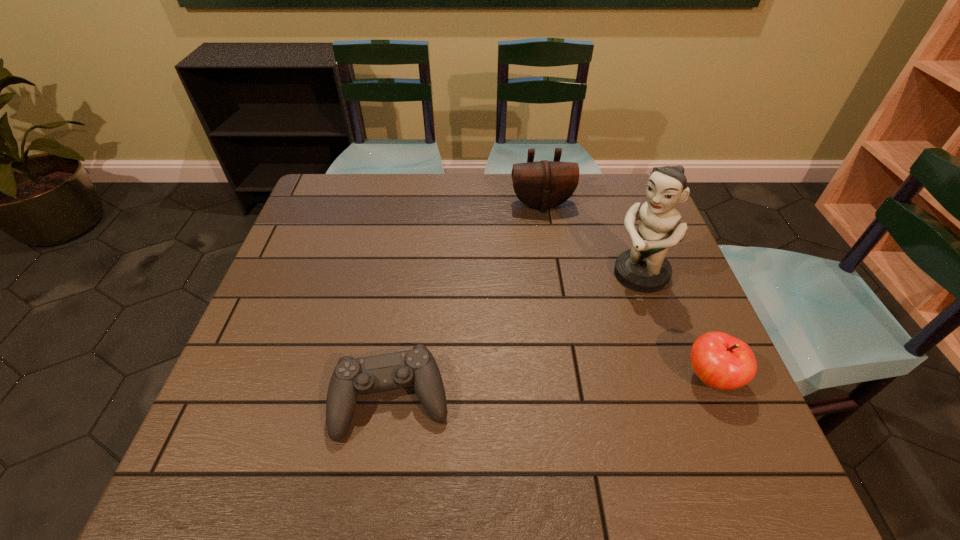
Locate an element on the screen. Image resolution: width=960 pixels, height=540 pixels. vacant space located with the flap open on the pouch is located at coordinates (561, 285).

Where is `vacant space located with the flap open on the pouch`? This screenshot has height=540, width=960. vacant space located with the flap open on the pouch is located at coordinates (558, 273).

Where is `free location located 0.230m on the front-facing side of the third nearest object`? The width and height of the screenshot is (960, 540). free location located 0.230m on the front-facing side of the third nearest object is located at coordinates (564, 340).

This screenshot has width=960, height=540. What are the coordinates of `vacant space located on the front-facing side of the third nearest object` in the screenshot? It's located at pyautogui.click(x=581, y=325).

Identify the location of vacant space located 0.200m on the front-facing side of the third nearest object. The width and height of the screenshot is (960, 540). [573, 332].

In order to click on object situated at the far edge in this screenshot , I will do `click(544, 184)`.

The height and width of the screenshot is (540, 960). Find the location of `control present at the near edge`. control present at the near edge is located at coordinates (417, 367).

Find the location of `apple that is at the near edge`. apple that is at the near edge is located at coordinates (721, 361).

In order to click on apple present at the right edge in this screenshot , I will do `click(721, 361)`.

The height and width of the screenshot is (540, 960). What are the coordinates of `figurine present at the right edge` in the screenshot? It's located at tap(643, 268).